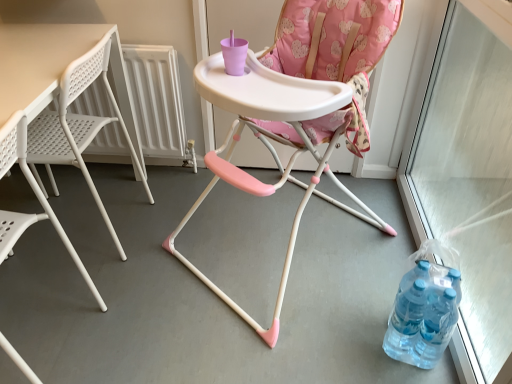
Image resolution: width=512 pixels, height=384 pixels. What do you see at coordinates (35, 194) in the screenshot? I see `white plastic chair at left, the second chair when ordered from right to left` at bounding box center [35, 194].

Where is `transparent plastic screen door at right`? transparent plastic screen door at right is located at coordinates (462, 123).

Image resolution: width=512 pixels, height=384 pixels. What do you see at coordinates (423, 315) in the screenshot?
I see `translucent plastic bottles at lower right` at bounding box center [423, 315].

Where is `white plastic table at left`? white plastic table at left is located at coordinates (76, 95).

Measure the distance between white plastic radiator at left and camera.

white plastic radiator at left is 5.73 feet away from camera.

Identify the location of white plastic chair at left, which appears as the first chair when viewed from the left. (35, 194).

From a real-world perspective, which is physically below, white plastic radiator at left or pink plastic highchair at center, the 2th chair from the left?

white plastic radiator at left.

Is point (114, 131) more distant than point (314, 10)?

That is True.

From the image's perspective, which one is positioned higher, white plastic radiator at left or pink plastic highchair at center, the 2th chair from the left?

white plastic radiator at left, from the image's perspective.

Who is smaller, white plastic radiator at left or pink plastic highchair at center, positioned as the 1th chair in right-to-left order?

white plastic radiator at left is smaller.

How different are the orientations of white plastic table at left and transparent plastic screen door at right in degrees?

There is a 0.638-degree angle between the facing directions of white plastic table at left and transparent plastic screen door at right.

Who is taller, white plastic table at left or transparent plastic screen door at right?

With more height is transparent plastic screen door at right.

In terms of width, does white plastic table at left look wider or thinner when compared to transparent plastic screen door at right?

Considering their sizes, white plastic table at left looks broader than transparent plastic screen door at right.

Consider the image. Is white plastic table at left facing away from transparent plastic screen door at right?

Yes, white plastic table at left's orientation is away from transparent plastic screen door at right.

How many degrees apart are the facing directions of translucent plastic bottles at lower right and transparent plastic screen door at right?

There is a 20.7-degree angle between the facing directions of translucent plastic bottles at lower right and transparent plastic screen door at right.

Is translucent plastic bottles at lower right not near transparent plastic screen door at right?

No, translucent plastic bottles at lower right is not far away from transparent plastic screen door at right.

Based on their sizes in the image, would you say translucent plastic bottles at lower right is bigger or smaller than transparent plastic screen door at right?

Clearly, translucent plastic bottles at lower right is smaller in size than transparent plastic screen door at right.

Considering the relative positions of white plastic radiator at left and translucent plastic bottles at lower right in the image provided, is white plastic radiator at left to the left of translucent plastic bottles at lower right from the viewer's perspective?

Yes, white plastic radiator at left is to the left of translucent plastic bottles at lower right.

Choose the correct answer: Is white plastic radiator at left inside translucent plastic bottles at lower right or outside it?

The correct answer is: outside.

Is white plastic radiator at left closer to camera compared to translucent plastic bottles at lower right?

No, the depth of white plastic radiator at left is greater than that of translucent plastic bottles at lower right.

From a real-world perspective, does translucent plastic bottles at lower right sit lower than white plastic radiator at left?

Yes, from a real-world perspective, translucent plastic bottles at lower right is under white plastic radiator at left.

Considering the sizes of objects translucent plastic bottles at lower right and white plastic radiator at left in the image provided, who is shorter, translucent plastic bottles at lower right or white plastic radiator at left?

translucent plastic bottles at lower right is shorter.

Is the position of translucent plastic bottles at lower right less distant than that of white plastic radiator at left?

Yes, it is in front of white plastic radiator at left.

What are the coordinates of `bottle located in front of the white plastic radiator at left` in the screenshot? It's located at (423, 315).

Is white plastic radiator at left situated inside white plastic table at left or outside?

white plastic radiator at left is located beyond the bounds of white plastic table at left.

Does point (184, 143) appear closer or farther from the camera than point (53, 162)?

Point (184, 143) is positioned farther from the camera compared to point (53, 162).

How much distance is there between white plastic radiator at left and white plastic table at left?

white plastic radiator at left is 22.36 centimeters from white plastic table at left.

Does white plastic radiator at left have a lesser height compared to white plastic table at left?

Yes, white plastic radiator at left is shorter than white plastic table at left.

Is white plastic table at left not inside pink plastic highchair at center, the 2th chair from the left?

white plastic table at left is positioned outside pink plastic highchair at center, the 2th chair from the left.

From a real-world perspective, is white plastic table at left under pink plastic highchair at center, positioned as the 1th chair in right-to-left order?

Yes, from a real-world perspective, white plastic table at left is below pink plastic highchair at center, positioned as the 1th chair in right-to-left order.

Where is `table on the left of pink plastic highchair at center, positioned as the 1th chair in right-to-left order`? table on the left of pink plastic highchair at center, positioned as the 1th chair in right-to-left order is located at coordinates (76, 95).

Image resolution: width=512 pixels, height=384 pixels. In the image, there is a pink plastic highchair at center, positioned as the 1th chair in right-to-left order. What are the coordinates of `radiator above it (from the image's perspective)` in the screenshot? It's located at (158, 102).

Where is `screen door on the right of white plastic table at left`? This screenshot has width=512, height=384. screen door on the right of white plastic table at left is located at coordinates (462, 123).

Estimate the real-world distances between objects in this image. Which object is further from transparent plastic screen door at right, white plastic radiator at left or white plastic table at left?

white plastic table at left.

Considering their positions, is white plastic chair at left, the second chair when ordered from right to left, positioned further to pink plastic highchair at center, the 2th chair from the left, than transparent plastic screen door at right?

The object further to pink plastic highchair at center, the 2th chair from the left, is white plastic chair at left, the second chair when ordered from right to left.

Based on their spatial positions, is white plastic table at left or translucent plastic bottles at lower right closer to white plastic chair at left, which appears as the first chair when viewed from the left?

white plastic table at left is closer to white plastic chair at left, which appears as the first chair when viewed from the left.

From the image, which object appears to be farther from pink plastic highchair at center, the 2th chair from the left, translucent plastic bottles at lower right or white plastic radiator at left?

Among the two, white plastic radiator at left is located further to pink plastic highchair at center, the 2th chair from the left.

Consider the image. Based on their spatial positions, is transparent plastic screen door at right or translucent plastic bottles at lower right closer to pink plastic highchair at center, the 2th chair from the left?

translucent plastic bottles at lower right is closer to pink plastic highchair at center, the 2th chair from the left.

Consider the image. Considering their positions, is white plastic table at left positioned further to translucent plastic bottles at lower right than white plastic chair at left, which appears as the first chair when viewed from the left?

The object further to translucent plastic bottles at lower right is white plastic table at left.

Which object lies further to the anchor point pink plastic highchair at center, the 2th chair from the left, transparent plastic screen door at right or white plastic chair at left, which appears as the first chair when viewed from the left?

white plastic chair at left, which appears as the first chair when viewed from the left, is further to pink plastic highchair at center, the 2th chair from the left.

Looking at the image, which one is located closer to pink plastic highchair at center, positioned as the 1th chair in right-to-left order, white plastic radiator at left or transparent plastic screen door at right?

Based on the image, transparent plastic screen door at right appears to be nearer to pink plastic highchair at center, positioned as the 1th chair in right-to-left order.

Find the location of a particular element. radiator located between white plastic chair at left, which appears as the first chair when viewed from the left, and translucent plastic bottles at lower right in the left-right direction is located at coordinates (158, 102).

Identify the location of table between white plastic chair at left, the second chair when ordered from right to left, and pink plastic highchair at center, the 2th chair from the left, from left to right. (x=76, y=95).

Identify the location of table between white plastic chair at left, the second chair when ordered from right to left, and translucent plastic bottles at lower right from left to right. (76, 95).

Identify the location of chair between white plastic radiator at left and transparent plastic screen door at right. (312, 115).